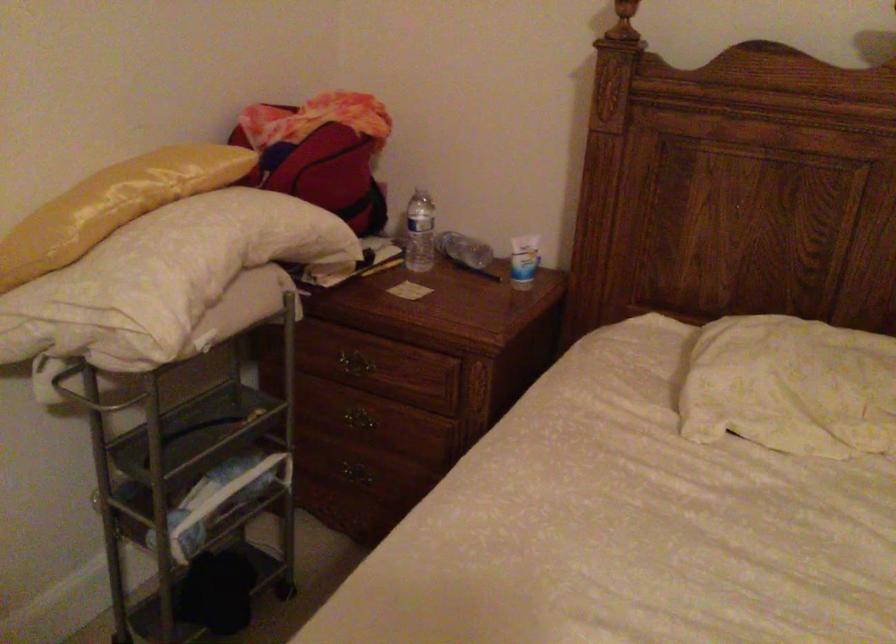
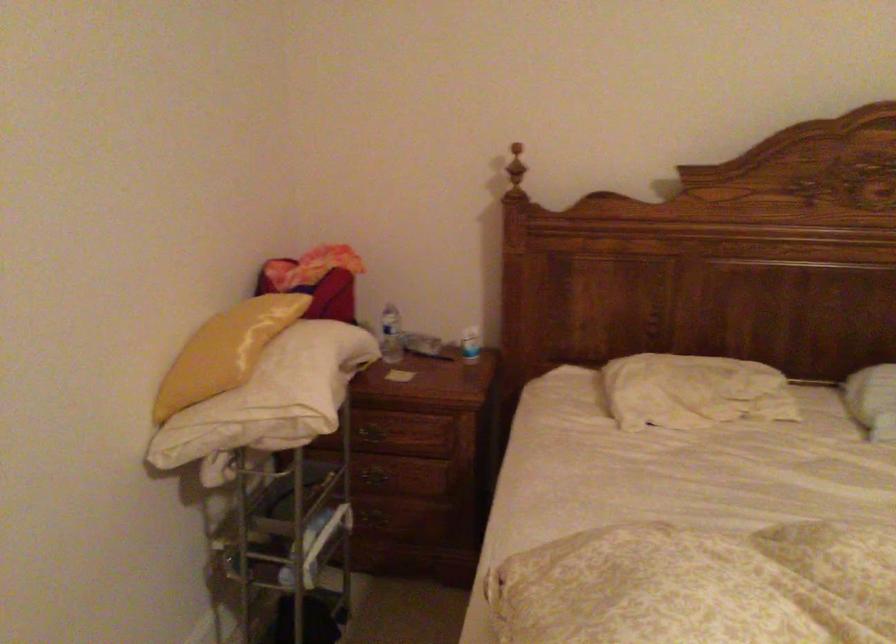
Where in the second image is the point corresponding to [357,357] from the first image?

(374, 430)